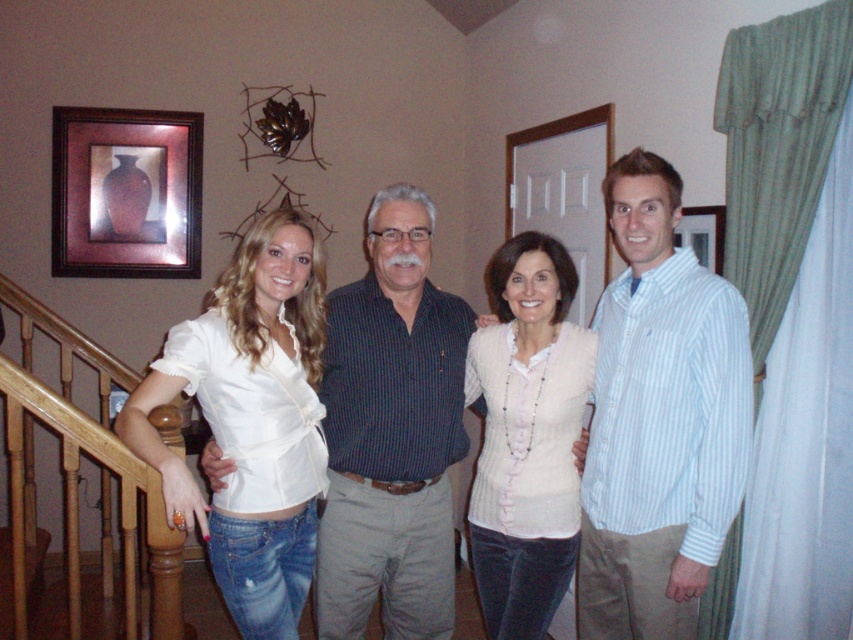
Locate an element on the screen. light blue striped shirt at right is located at coordinates (659, 420).

In the scene shown: Is light blue striped shirt at right in front of white satin blouse at left?

That is False.

Which is in front, point (657, 248) or point (286, 292)?

Positioned in front is point (286, 292).

The height and width of the screenshot is (640, 853). I want to click on light blue striped shirt at right, so click(x=659, y=420).

Describe the element at coordinates (392, 433) in the screenshot. I see `dark blue striped shirt at center` at that location.

Can you confirm if dark blue striped shirt at center is positioned to the right of white satin blouse at left?

Yes, dark blue striped shirt at center is to the right of white satin blouse at left.

Who is more distant from viewer, (433, 445) or (289, 355)?

The point (433, 445) is behind.

The height and width of the screenshot is (640, 853). I want to click on dark blue striped shirt at center, so click(392, 433).

Which is more to the left, light blue striped shirt at right or dark blue striped shirt at center?

dark blue striped shirt at center

Who is higher up, light blue striped shirt at right or dark blue striped shirt at center?

Positioned higher is light blue striped shirt at right.

The image size is (853, 640). What are the coordinates of `light blue striped shirt at right` in the screenshot? It's located at (659, 420).

Where is `light blue striped shirt at right`? The width and height of the screenshot is (853, 640). light blue striped shirt at right is located at coordinates (659, 420).